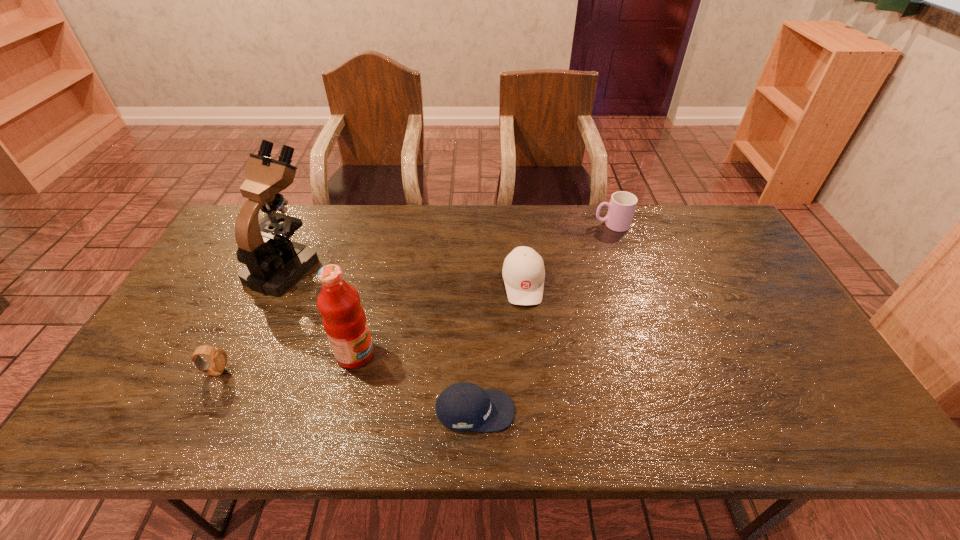
Where is `vacant space that's between the microscope and the taller baseball cap`? The height and width of the screenshot is (540, 960). vacant space that's between the microscope and the taller baseball cap is located at coordinates (404, 275).

This screenshot has width=960, height=540. Find the location of `free space between the cup and the nearer baseball cap`. free space between the cup and the nearer baseball cap is located at coordinates (543, 318).

Identify the location of empty space between the rightmost object and the nearest object. (543, 318).

The image size is (960, 540). I want to click on empty location between the watch and the fifth shortest object, so click(x=285, y=363).

Where is `empty space between the third object from left to right and the watch`? This screenshot has width=960, height=540. empty space between the third object from left to right and the watch is located at coordinates (285, 363).

You are a GUI agent. You are given a task and a screenshot of the screen. Output one action in this format:
    pyautogui.click(x=<x>, y=<y>)
    Task: Click on the empty space between the watch and the tallest object
    This screenshot has height=540, width=960.
    Given the screenshot: What is the action you would take?
    pyautogui.click(x=251, y=319)

You are a GUI agent. You are given a task and a screenshot of the screen. Output one action in this format:
    pyautogui.click(x=<x>, y=<y>)
    Task: Click on the object that is the third closest to the fruit juice
    The image size is (960, 540).
    Given the screenshot: What is the action you would take?
    pyautogui.click(x=218, y=357)

Where is `object that is the second closest to the tallest object`? The image size is (960, 540). object that is the second closest to the tallest object is located at coordinates (218, 357).

Identify the location of vacant space that satisfies the following two spatial constraints: 1. on the front-facing side of the farther baseball cap; 2. on the front-facing side of the nearest object. Image resolution: width=960 pixels, height=540 pixels. (536, 411).